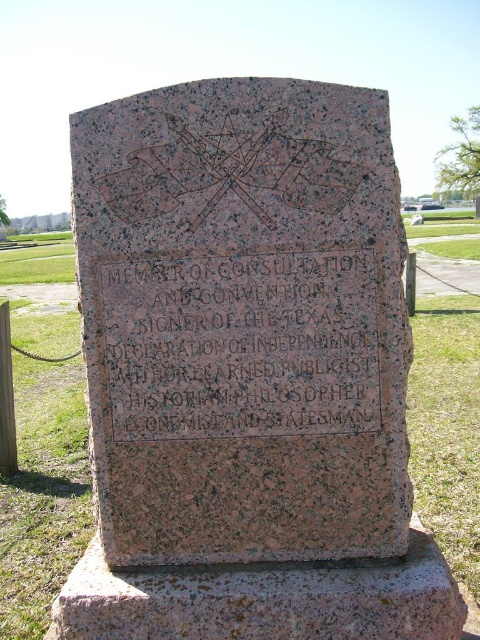
Question: Does granite stone at center come behind black granite stone at center?

Choices:
 (A) no
 (B) yes

Answer: (A)

Question: Which of the following is the farthest from the observer?

Choices:
 (A) black granite stone at center
 (B) granite stone at center

Answer: (A)

Question: Can you confirm if granite stone at center is smaller than black granite stone at center?

Choices:
 (A) no
 (B) yes

Answer: (A)

Question: Among these points, which one is farthest from the camera?

Choices:
 (A) (173, 417)
 (B) (312, 557)

Answer: (B)

Question: Is granite stone at center above black granite stone at center?

Choices:
 (A) no
 (B) yes

Answer: (B)

Question: Which of the following is the farthest from the observer?

Choices:
 (A) granite stone at center
 (B) black granite stone at center

Answer: (B)